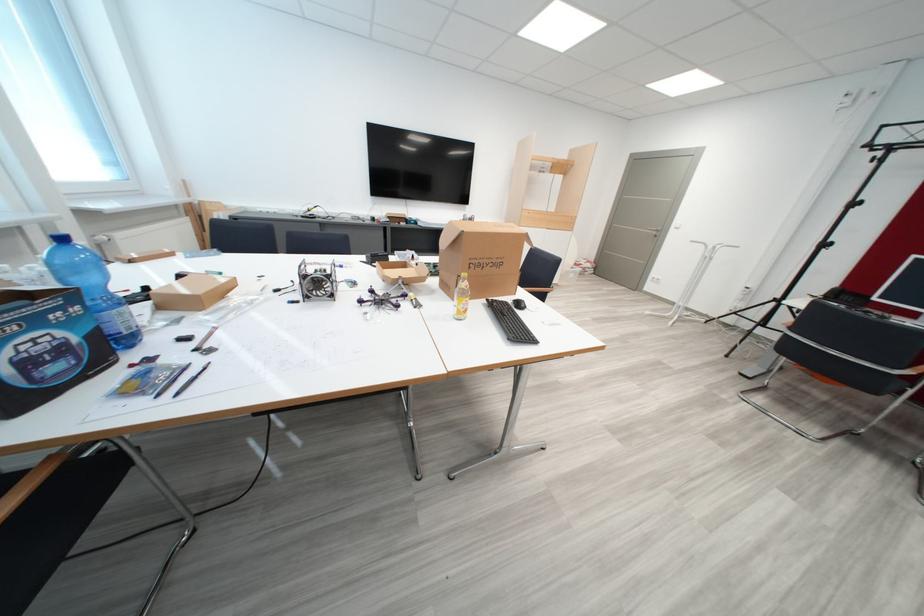
At what (x,y) coordinates should I click in order to perform the action: click on gray door handle. Please return your answer as a coordinate pair (x, y). The width and height of the screenshot is (924, 616). Looking at the image, I should click on pos(648,238).